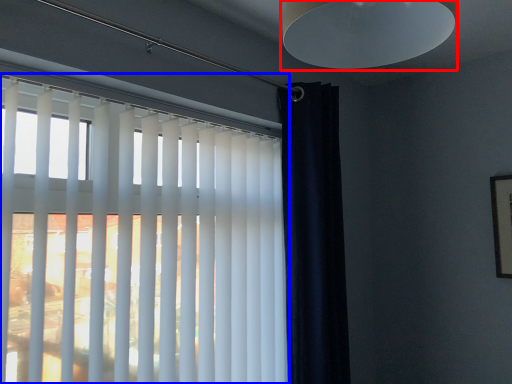
Question: Which of the following is the closest to the observer, lamp (highlighted by a red box) or window blind (highlighted by a blue box)?

Choices:
 (A) lamp
 (B) window blind

Answer: (A)